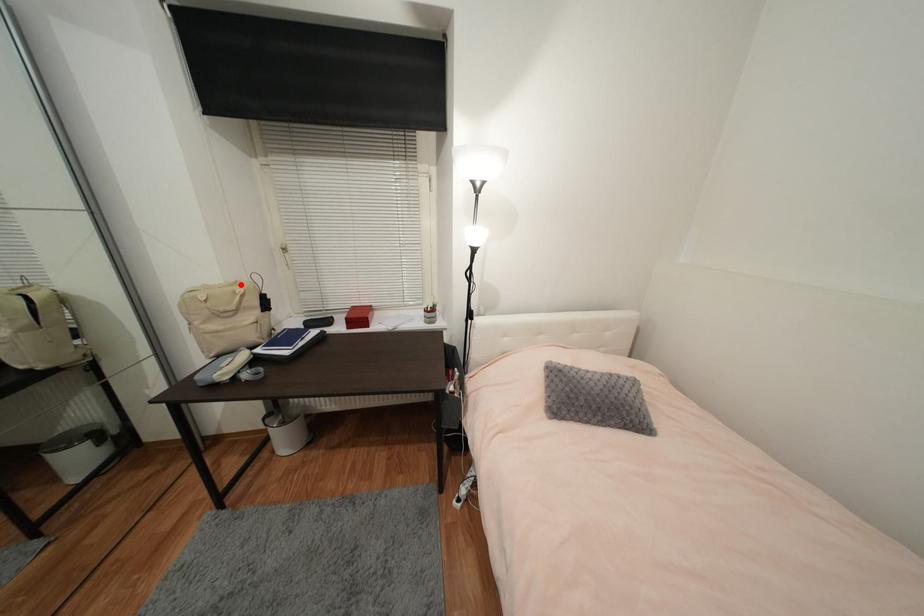
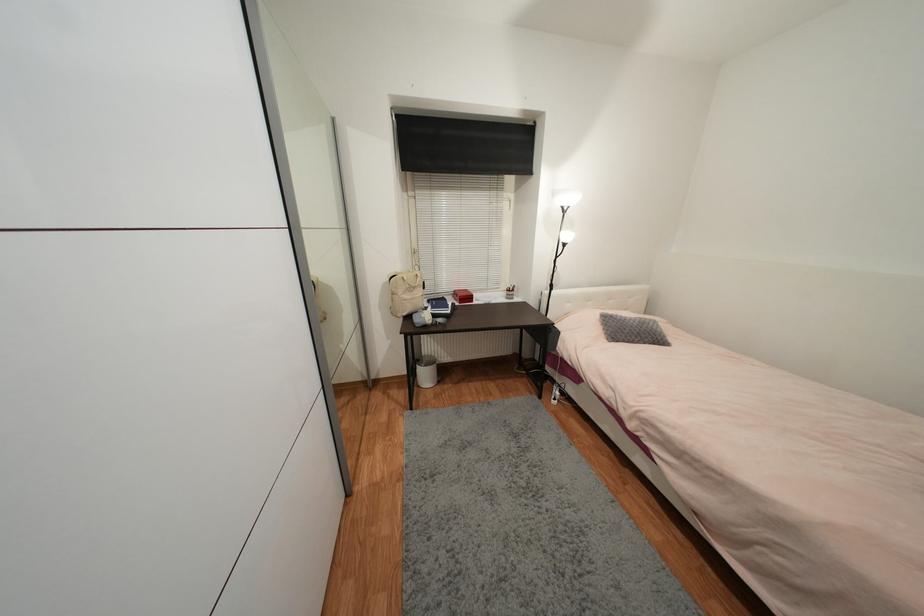
Find the pixel in the second image that matches the highlighted location in the first image.

(412, 273)